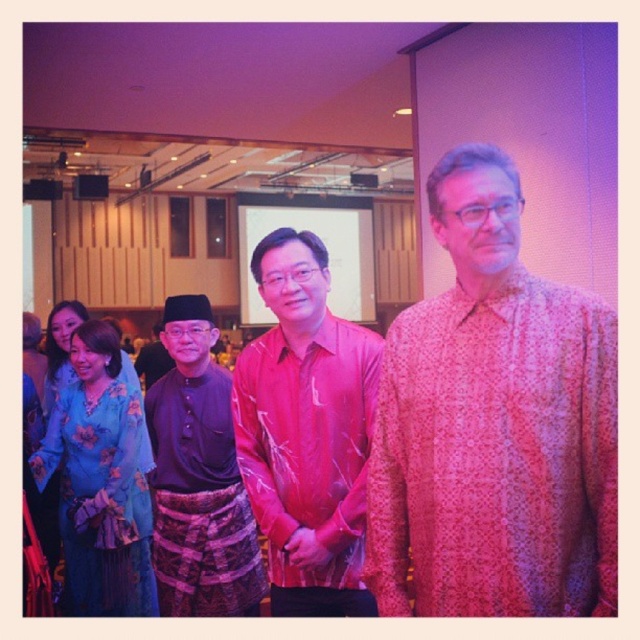
You are at a cultural event and see the pink floral shirt at center and the blue floral dress at lower left. Which one is positioned to the right of the other?

The pink floral shirt at center is positioned to the right of the blue floral dress at lower left.

You are organizing a photo shoot and need to ensure that the pink floral shirt at center and the pink printed shirt at center are spaced exactly 24 inches apart for the composition. Based on their current positions in the image, do you need to move them closer or farther apart?

The pink floral shirt at center and the pink printed shirt at center are currently 22.07 inches apart. Since the required distance is 24 inches, you need to move them farther apart to achieve the desired spacing.

You are at an event and see the dark brown batik at left and the blue floral dress at lower left. Which one is higher in position?

The dark brown batik at left is located above the blue floral dress at lower left, so it is higher in position.